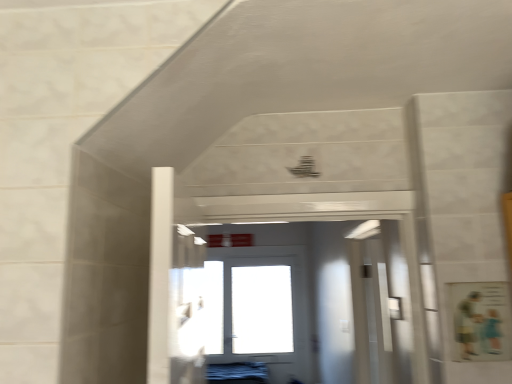
Find the location of `white glossy door at center, marked as the first door in a front-to-back arrangement`. white glossy door at center, marked as the first door in a front-to-back arrangement is located at coordinates (310, 282).

Describe the element at coordinates (310, 282) in the screenshot. The width and height of the screenshot is (512, 384). I see `white glossy door at center, the 2th door when ordered from back to front` at that location.

Image resolution: width=512 pixels, height=384 pixels. What do you see at coordinates (260, 309) in the screenshot?
I see `white glossy door at center, arranged as the 2th door when viewed from the top` at bounding box center [260, 309].

Based on the photo, what is the approximate height of white glossy door at center, arranged as the first door when ordered from the bottom?

It is 4.34 feet.

Where is `white glossy door at center, which is counted as the 2th door, starting from the front`? white glossy door at center, which is counted as the 2th door, starting from the front is located at coordinates (x=260, y=309).

At what (x,y) coordinates should I click in order to perform the action: click on white glossy door at center, placed as the 2th door when sorted from bottom to top. Please return your answer as a coordinate pair (x, y). Image resolution: width=512 pixels, height=384 pixels. Looking at the image, I should click on click(x=310, y=282).

Is white glossy door at center, which is the first door from back to front, to the left or to the right of white glossy door at center, the 2th door when ordered from back to front, in the image?

white glossy door at center, which is the first door from back to front, is positioned on white glossy door at center, the 2th door when ordered from back to front,'s left side.

Considering the positions of objects white glossy door at center, which is counted as the 2th door, starting from the front, and white glossy door at center, the 2th door when ordered from back to front, in the image provided, who is behind, white glossy door at center, which is counted as the 2th door, starting from the front, or white glossy door at center, the 2th door when ordered from back to front,?

white glossy door at center, which is counted as the 2th door, starting from the front, is further away from the camera.

Considering the positions of points (221, 346) and (316, 250), is point (221, 346) farther from camera compared to point (316, 250)?

Yes.

From the image's perspective, which is below, white glossy door at center, which is the first door from back to front, or white glossy door at center, marked as the first door in a front-to-back arrangement?

From the image's view, white glossy door at center, which is the first door from back to front, is below.

From a real-world perspective, is white glossy door at center, arranged as the 2th door when viewed from the top, over white glossy door at center, the 2th door when ordered from back to front?

No.

Is white glossy door at center, which is the first door from back to front, thinner than white glossy door at center, the 1th door from the top?

Indeed, white glossy door at center, which is the first door from back to front, has a lesser width compared to white glossy door at center, the 1th door from the top.

From their relative heights in the image, would you say white glossy door at center, which is counted as the 2th door, starting from the front, is taller or shorter than white glossy door at center, marked as the first door in a front-to-back arrangement?

white glossy door at center, which is counted as the 2th door, starting from the front, is taller than white glossy door at center, marked as the first door in a front-to-back arrangement.

Is white glossy door at center, arranged as the 2th door when viewed from the top, smaller than white glossy door at center, the 1th door from the top?

Actually, white glossy door at center, arranged as the 2th door when viewed from the top, might be larger than white glossy door at center, the 1th door from the top.

Is white glossy door at center, arranged as the first door when ordered from the bottom, situated inside white glossy door at center, the 2th door when ordered from back to front, or outside?

white glossy door at center, arranged as the first door when ordered from the bottom, is outside white glossy door at center, the 2th door when ordered from back to front.

Is there a large distance between white glossy door at center, arranged as the first door when ordered from the bottom, and white glossy door at center, the 2th door when ordered from back to front?

That's not correct — white glossy door at center, arranged as the first door when ordered from the bottom, is a little close to white glossy door at center, the 2th door when ordered from back to front.

Does white glossy door at center, which is counted as the 2th door, starting from the front, turn towards white glossy door at center, marked as the first door in a front-to-back arrangement?

Yes, white glossy door at center, which is counted as the 2th door, starting from the front, is facing white glossy door at center, marked as the first door in a front-to-back arrangement.

How much distance is there between white glossy door at center, which is counted as the 2th door, starting from the front, and white glossy door at center, marked as the first door in a front-to-back arrangement?

white glossy door at center, which is counted as the 2th door, starting from the front, and white glossy door at center, marked as the first door in a front-to-back arrangement, are 10.56 inches apart.

Locate an element on the screen. The height and width of the screenshot is (384, 512). door that is under the white glossy door at center, the 1th door from the top (from a real-world perspective) is located at coordinates (260, 309).

In the scene shown: Considering the positions of objects white glossy door at center, the 1th door from the top, and white glossy door at center, arranged as the 2th door when viewed from the top, in the image provided, who is more to the right, white glossy door at center, the 1th door from the top, or white glossy door at center, arranged as the 2th door when viewed from the top,?

Positioned to the right is white glossy door at center, the 1th door from the top.

Which object is more forward, white glossy door at center, the 1th door from the top, or white glossy door at center, arranged as the 2th door when viewed from the top?

white glossy door at center, the 1th door from the top, is closer to the camera.

Is point (277, 318) closer or farther from the camera than point (284, 293)?

Point (277, 318).

From the picture: From the image's perspective, relative to white glossy door at center, arranged as the 2th door when viewed from the top, is white glossy door at center, marked as the first door in a front-to-back arrangement, above or below?

Based on their image positions, white glossy door at center, marked as the first door in a front-to-back arrangement, is located above white glossy door at center, arranged as the 2th door when viewed from the top.

From a real-world perspective, between white glossy door at center, placed as the 2th door when sorted from bottom to top, and white glossy door at center, which is counted as the 2th door, starting from the front, who is vertically lower?

white glossy door at center, which is counted as the 2th door, starting from the front, from a real-world perspective.

Which of these two, white glossy door at center, the 2th door when ordered from back to front, or white glossy door at center, arranged as the 2th door when viewed from the top, is wider?

white glossy door at center, the 2th door when ordered from back to front, is wider.

Considering the sizes of objects white glossy door at center, the 1th door from the top, and white glossy door at center, arranged as the 2th door when viewed from the top, in the image provided, who is taller, white glossy door at center, the 1th door from the top, or white glossy door at center, arranged as the 2th door when viewed from the top,?

white glossy door at center, arranged as the 2th door when viewed from the top.

Between white glossy door at center, placed as the 2th door when sorted from bottom to top, and white glossy door at center, which is counted as the 2th door, starting from the front, which one has smaller size?

white glossy door at center, placed as the 2th door when sorted from bottom to top, is smaller.

Is white glossy door at center, the 2th door when ordered from back to front, spatially inside white glossy door at center, arranged as the 2th door when viewed from the top, or outside of it?

The correct answer is: outside.

Is white glossy door at center, marked as the first door in a front-to-back arrangement, in contact with white glossy door at center, which is counted as the 2th door, starting from the front?

white glossy door at center, marked as the first door in a front-to-back arrangement, and white glossy door at center, which is counted as the 2th door, starting from the front, are not in contact.

Is white glossy door at center, the 2th door when ordered from back to front, facing away from white glossy door at center, arranged as the first door when ordered from the bottom?

Correct, white glossy door at center, the 2th door when ordered from back to front, is looking away from white glossy door at center, arranged as the first door when ordered from the bottom.

What's the angular difference between white glossy door at center, marked as the first door in a front-to-back arrangement, and white glossy door at center, which is the first door from back to front,'s facing directions?

They differ by 0.484 degrees in their facing directions.

In order to click on door located on the left of white glossy door at center, the 2th door when ordered from back to front in this screenshot , I will do `click(260, 309)`.

Identify the location of door in front of the white glossy door at center, which is the first door from back to front. pyautogui.click(x=310, y=282).

Locate an element on the screen. door located on the right of white glossy door at center, which is counted as the 2th door, starting from the front is located at coordinates (310, 282).